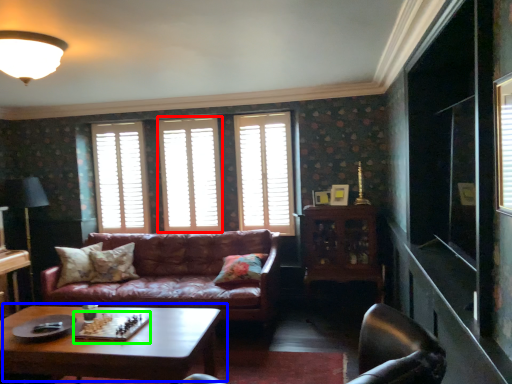
Question: Which object is positioned farthest from window (highlighted by a red box)? Select from coffee table (highlighted by a blue box) and board game (highlighted by a green box).

Choices:
 (A) coffee table
 (B) board game

Answer: (B)